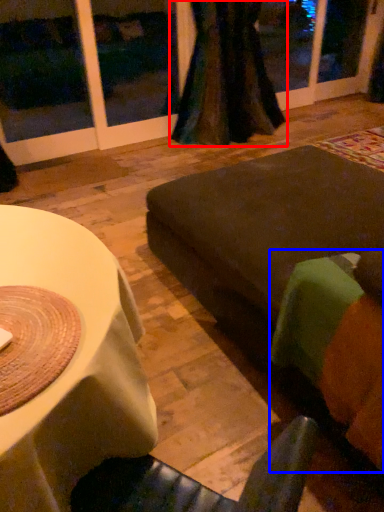
Question: Among these objects, which one is farthest to the camera, curtain (highlighted by a red box) or couch (highlighted by a blue box)?

Choices:
 (A) curtain
 (B) couch

Answer: (A)